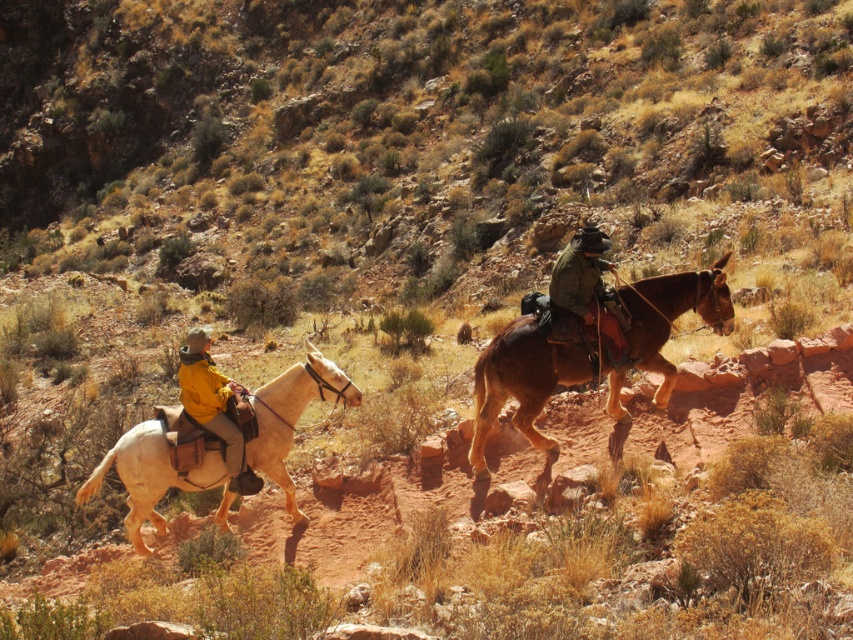
Question: Is white leather horse at left positioned behind green matte jacket at center?

Choices:
 (A) yes
 (B) no

Answer: (B)

Question: Is brown leather horse at center positioned in front of green matte jacket at center?

Choices:
 (A) yes
 (B) no

Answer: (A)

Question: Which object is the closest to the white leather horse at left?

Choices:
 (A) brown leather horse at center
 (B) yellow matte jacket at left

Answer: (B)

Question: Which object is farther from the camera taking this photo?

Choices:
 (A) brown leather horse at center
 (B) yellow matte jacket at left
 (C) white leather horse at left

Answer: (B)

Question: Can you confirm if brown leather horse at center is positioned to the left of yellow matte jacket at left?

Choices:
 (A) no
 (B) yes

Answer: (A)

Question: Which point is farther to the camera?

Choices:
 (A) green matte jacket at center
 (B) white leather horse at left
 (C) brown leather horse at center
 (D) yellow matte jacket at left

Answer: (D)